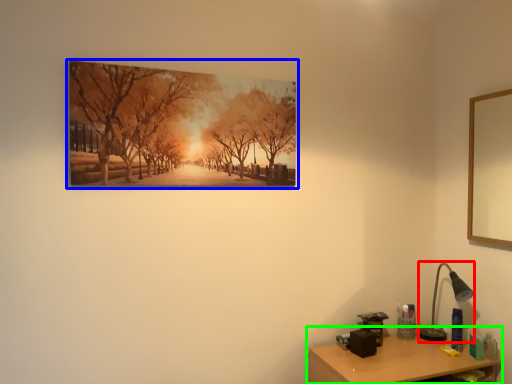
Question: Which is nearer to the table lamp (highlighted by a red box)? picture frame (highlighted by a blue box) or table (highlighted by a green box).

Choices:
 (A) picture frame
 (B) table

Answer: (B)